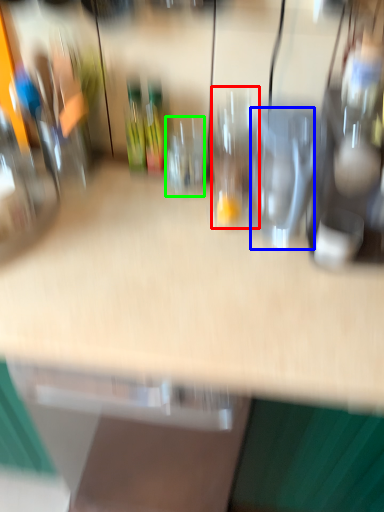
Question: Which is nearer to the wine glass (highlighted by a red box)? wine glass (highlighted by a blue box) or wine glass (highlighted by a green box).

Choices:
 (A) wine glass
 (B) wine glass

Answer: (B)